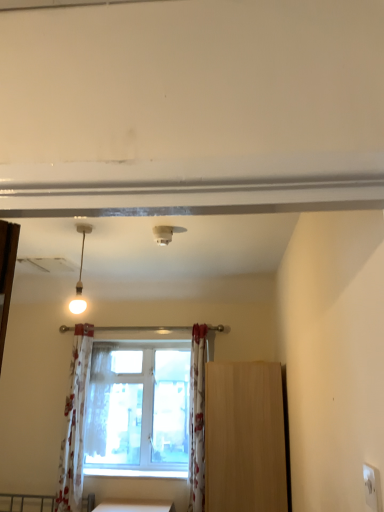
Question: Are white plastic smoke detector at upper center and matte white pendant light at upper left located far from each other?

Choices:
 (A) no
 (B) yes

Answer: (A)

Question: From the image's perspective, is white plastic smoke detector at upper center under matte white pendant light at upper left?

Choices:
 (A) no
 (B) yes

Answer: (A)

Question: Does white plastic smoke detector at upper center appear on the right side of matte white pendant light at upper left?

Choices:
 (A) no
 (B) yes

Answer: (B)

Question: Is white plastic smoke detector at upper center wider than matte white pendant light at upper left?

Choices:
 (A) yes
 (B) no

Answer: (A)

Question: Considering the relative sizes of white plastic smoke detector at upper center and matte white pendant light at upper left in the image provided, is white plastic smoke detector at upper center thinner than matte white pendant light at upper left?

Choices:
 (A) yes
 (B) no

Answer: (B)

Question: Can you confirm if white plastic smoke detector at upper center is shorter than matte white pendant light at upper left?

Choices:
 (A) no
 (B) yes

Answer: (B)

Question: Would you say white floral fabric curtain at center, acting as the first curtain starting from the right, is part of light brown wood cabinet at right's contents?

Choices:
 (A) no
 (B) yes

Answer: (A)

Question: Can you confirm if light brown wood cabinet at right is wider than white floral fabric curtain at center, the second curtain from the left?

Choices:
 (A) yes
 (B) no

Answer: (A)

Question: Is light brown wood cabinet at right smaller than white floral fabric curtain at center, acting as the first curtain starting from the right?

Choices:
 (A) no
 (B) yes

Answer: (A)

Question: Would you consider light brown wood cabinet at right to be distant from white floral fabric curtain at center, the second curtain from the left?

Choices:
 (A) no
 (B) yes

Answer: (A)

Question: From the image's perspective, is light brown wood cabinet at right located beneath white floral fabric curtain at center, the second curtain from the left?

Choices:
 (A) yes
 (B) no

Answer: (A)

Question: Is light brown wood cabinet at right at the right side of white floral fabric curtain at center, the second curtain from the left?

Choices:
 (A) no
 (B) yes

Answer: (B)

Question: Does clear glass window at center have a greater width compared to white plastic electric outlet at lower right?

Choices:
 (A) yes
 (B) no

Answer: (A)